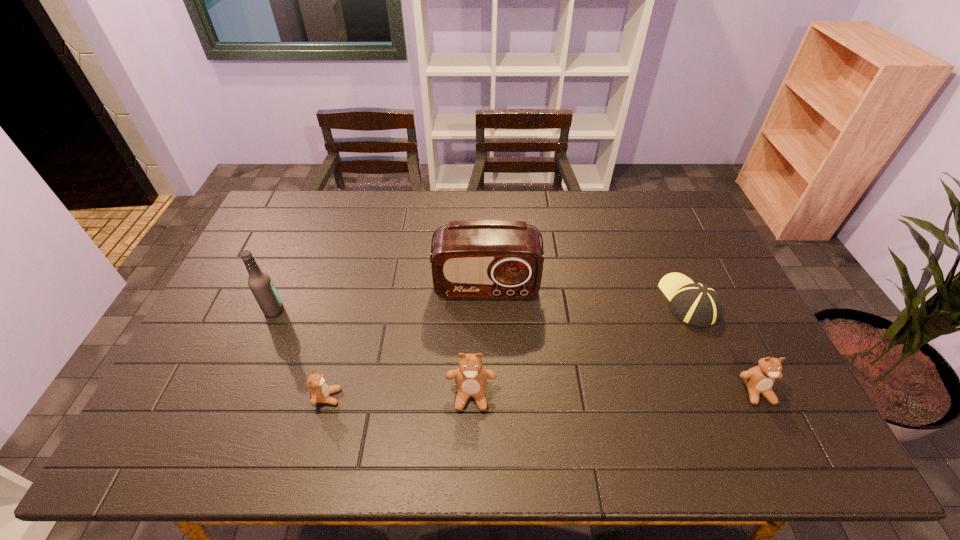
Where is `the leftmost teddy bear`? The width and height of the screenshot is (960, 540). the leftmost teddy bear is located at coordinates (320, 392).

Identify the location of the second object from left to right. Image resolution: width=960 pixels, height=540 pixels. pyautogui.click(x=320, y=392).

Identify the location of the second teddy bear from right to left. This screenshot has width=960, height=540. 471,378.

Where is `the fourth shortest object`? the fourth shortest object is located at coordinates (471, 378).

The height and width of the screenshot is (540, 960). Find the location of `the second tallest teddy bear`. the second tallest teddy bear is located at coordinates (759, 379).

Find the location of a particular element. The height and width of the screenshot is (540, 960). the fourth tallest object is located at coordinates (759, 379).

The height and width of the screenshot is (540, 960). Identify the location of the leftmost object. (259, 282).

Find the location of a particular element. This screenshot has height=540, width=960. radio receiver is located at coordinates (471, 259).

Find the location of a particular element. This screenshot has width=960, height=540. baseball cap is located at coordinates coord(696,304).

Image resolution: width=960 pixels, height=540 pixels. I want to click on free spot located on the front-facing side of the second object from left to right, so point(408,397).